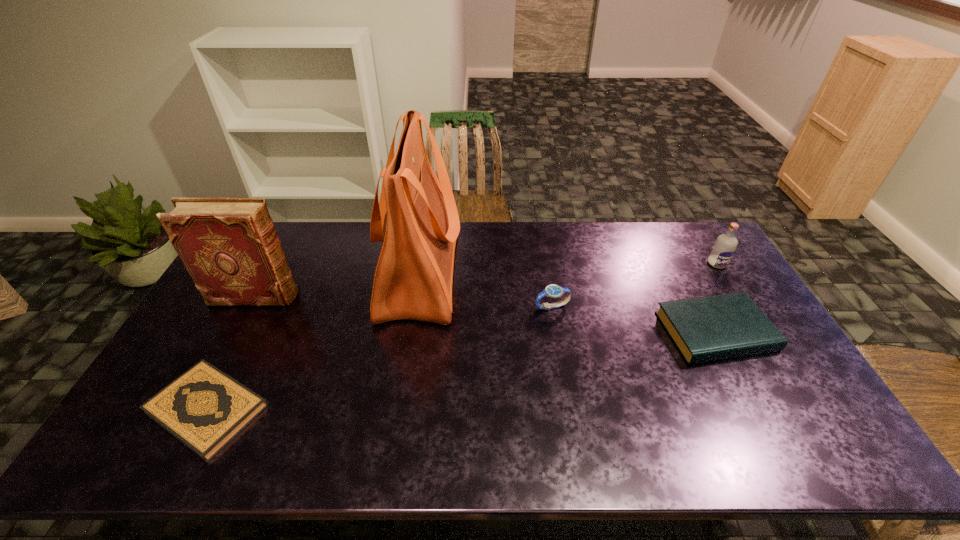
Find the location of `free space that satisfies the following two spatial constraints: 1. on the back side of the second tallest hardback book; 2. on the front pocket of the shopping bag`. free space that satisfies the following two spatial constraints: 1. on the back side of the second tallest hardback book; 2. on the front pocket of the shopping bag is located at coordinates (684, 273).

Locate an element on the screen. This screenshot has height=540, width=960. vacant space that satisfies the following two spatial constraints: 1. on the back side of the fourth tallest object; 2. on the front pocket of the shopping bag is located at coordinates pyautogui.click(x=546, y=273).

You are a GUI agent. You are given a task and a screenshot of the screen. Output one action in this format:
    pyautogui.click(x=<x>, y=<y>)
    Task: Click on the vacant space that satisfies the following two spatial constraints: 1. on the spine side of the tallest hardback book; 2. on the back side of the third object from right to left
    This screenshot has width=960, height=540.
    Given the screenshot: What is the action you would take?
    pyautogui.click(x=250, y=307)

Identify the location of free point that satisfies the following two spatial constraints: 1. on the spine side of the tallest hardback book; 2. on the left side of the shortest hardback book. (194, 409).